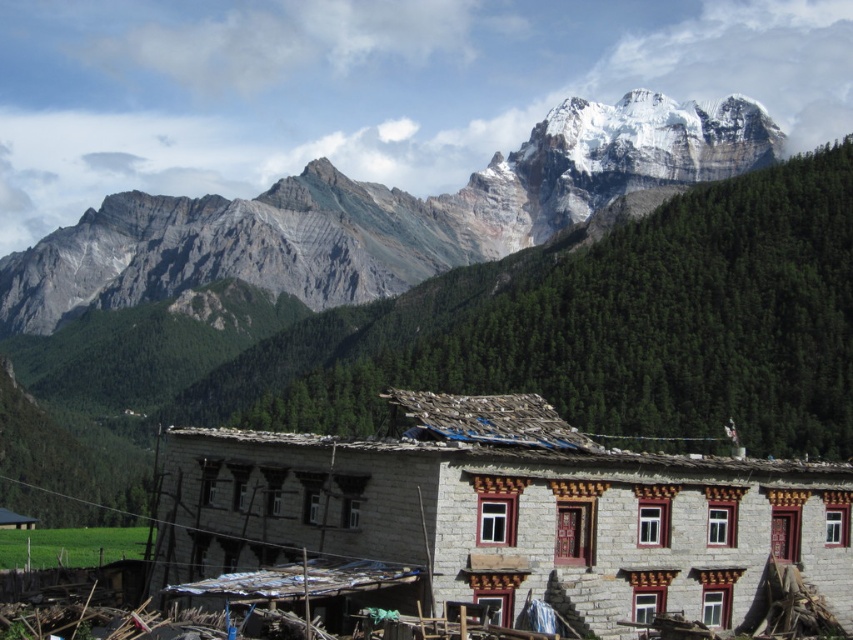
You are planning to build a new shed and want to ensure it fits within the available space. The shed will be the same size as the rustic wooden hut at lower left. Based on the scene, can you determine if the white stone building at center has enough space to accommodate the new shed next to it?

The white stone building at center might be wider than rustic wooden hut at lower left, so there might be enough space to accommodate the new shed next to it.